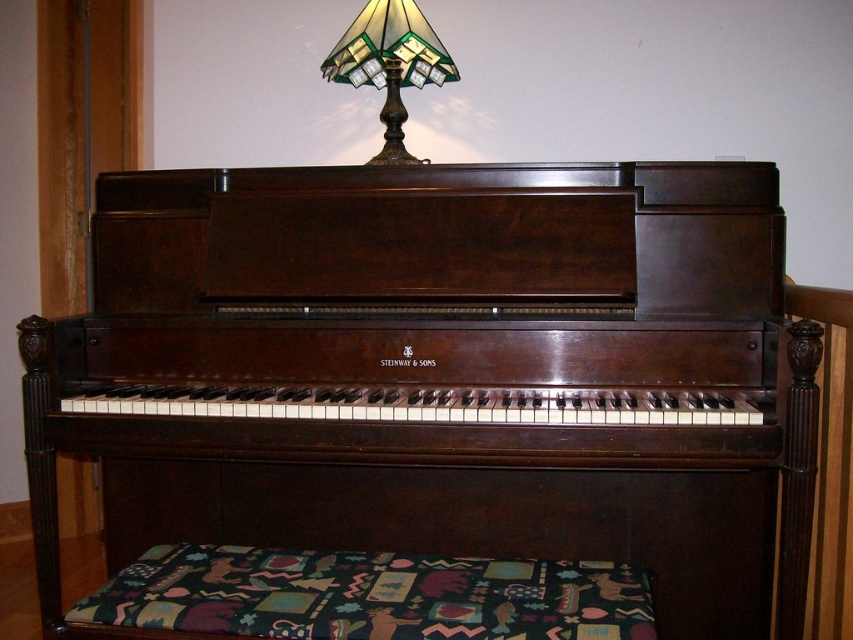
Is dark fabric footrest at lower center further to camera compared to stained glass lampshade at upper center?

No, it is not.

Locate an element on the screen. dark fabric footrest at lower center is located at coordinates (369, 595).

At what (x,y) coordinates should I click in order to perform the action: click on dark fabric footrest at lower center. Please return your answer as a coordinate pair (x, y). Looking at the image, I should click on (369, 595).

Between shiny dark wood piano at center and dark fabric footrest at lower center, which one is positioned lower?

dark fabric footrest at lower center is lower down.

Is shiny dark wood piano at center shorter than dark fabric footrest at lower center?

No.

Between point (741, 365) and point (287, 602), which one is positioned behind?

Point (741, 365)

Locate an element on the screen. The image size is (853, 640). shiny dark wood piano at center is located at coordinates (442, 374).

Can you confirm if shiny dark wood piano at center is wider than stained glass lampshade at upper center?

Indeed, shiny dark wood piano at center has a greater width compared to stained glass lampshade at upper center.

Between shiny dark wood piano at center and stained glass lampshade at upper center, which one appears on the right side from the viewer's perspective?

shiny dark wood piano at center is more to the right.

Who is more distant from viewer, (115, 392) or (405, 20)?

Point (405, 20)

Locate an element on the screen. shiny dark wood piano at center is located at coordinates (442, 374).